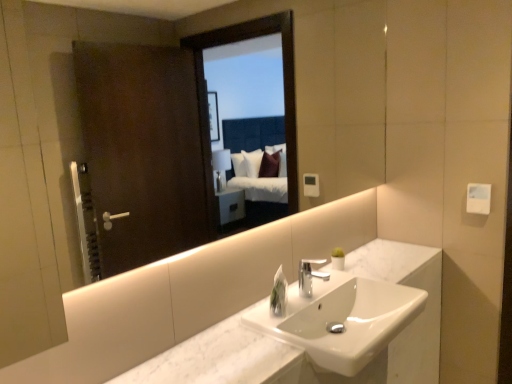
Question: Would you say clear plastic soap dispenser at center is outside silver metallic faucet at center?

Choices:
 (A) yes
 (B) no

Answer: (A)

Question: Does clear plastic soap dispenser at center have a greater width compared to silver metallic faucet at center?

Choices:
 (A) yes
 (B) no

Answer: (B)

Question: Does clear plastic soap dispenser at center have a lesser width compared to silver metallic faucet at center?

Choices:
 (A) yes
 (B) no

Answer: (A)

Question: Is clear plastic soap dispenser at center positioned in front of silver metallic faucet at center?

Choices:
 (A) yes
 (B) no

Answer: (A)

Question: Is the position of clear plastic soap dispenser at center more distant than that of silver metallic faucet at center?

Choices:
 (A) no
 (B) yes

Answer: (A)

Question: Considering the positions of white marble sink at center and silver metallic faucet at center in the image, is white marble sink at center taller or shorter than silver metallic faucet at center?

Choices:
 (A) short
 (B) tall

Answer: (B)

Question: Looking at the image, does white marble sink at center seem bigger or smaller compared to silver metallic faucet at center?

Choices:
 (A) small
 (B) big

Answer: (B)

Question: Is white marble sink at center inside the boundaries of silver metallic faucet at center, or outside?

Choices:
 (A) inside
 (B) outside

Answer: (B)

Question: Relative to silver metallic faucet at center, is white marble sink at center in front or behind?

Choices:
 (A) front
 (B) behind

Answer: (A)

Question: Which is correct: white marble counter at center is inside clear plastic soap dispenser at center, or outside of it?

Choices:
 (A) outside
 (B) inside

Answer: (A)

Question: Considering the positions of white marble counter at center and clear plastic soap dispenser at center in the image, is white marble counter at center wider or thinner than clear plastic soap dispenser at center?

Choices:
 (A) thin
 (B) wide

Answer: (B)

Question: Considering their positions, is white marble counter at center located in front of or behind clear plastic soap dispenser at center?

Choices:
 (A) behind
 (B) front

Answer: (B)

Question: Looking at the image, does white marble counter at center seem bigger or smaller compared to clear plastic soap dispenser at center?

Choices:
 (A) small
 (B) big

Answer: (B)

Question: Considering the positions of silver metallic faucet at center and white marble counter at center in the image, is silver metallic faucet at center bigger or smaller than white marble counter at center?

Choices:
 (A) big
 (B) small

Answer: (B)

Question: Considering the positions of silver metallic faucet at center and white marble counter at center in the image, is silver metallic faucet at center taller or shorter than white marble counter at center?

Choices:
 (A) short
 (B) tall

Answer: (B)